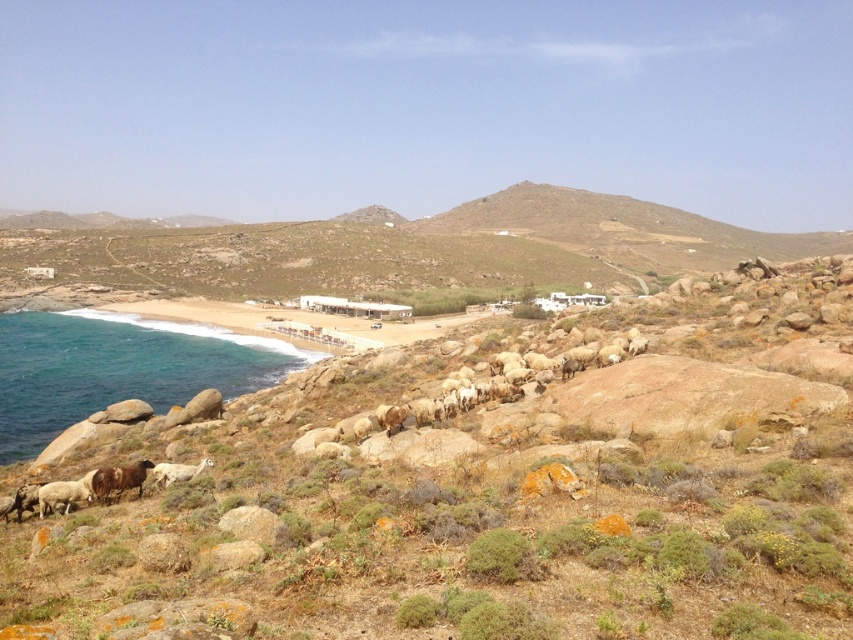
Question: Does blue water at lower left have a larger size compared to white woolly sheep at lower center?

Choices:
 (A) yes
 (B) no

Answer: (A)

Question: Which object is farther from the camera taking this photo?

Choices:
 (A) blue water at lower left
 (B) brown rocky hillside at center

Answer: (B)

Question: Which of these objects is positioned closest to the white woolly sheep at lower center?

Choices:
 (A) blue water at lower left
 (B) brown rocky hillside at center

Answer: (A)

Question: Does blue water at lower left lie behind white woolly sheep at lower center?

Choices:
 (A) no
 (B) yes

Answer: (B)

Question: Which of these objects is positioned closest to the blue water at lower left?

Choices:
 (A) white woolly sheep at lower center
 (B) brown rocky hillside at center

Answer: (A)

Question: Can you confirm if brown rocky hillside at center is positioned above blue water at lower left?

Choices:
 (A) no
 (B) yes

Answer: (B)